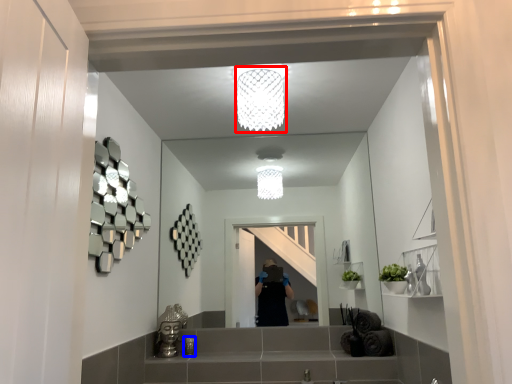
Question: Among these objects, which one is nearest to the camera, light fixture (highlighted by a red box) or toiletry (highlighted by a blue box)?

Choices:
 (A) light fixture
 (B) toiletry

Answer: (A)